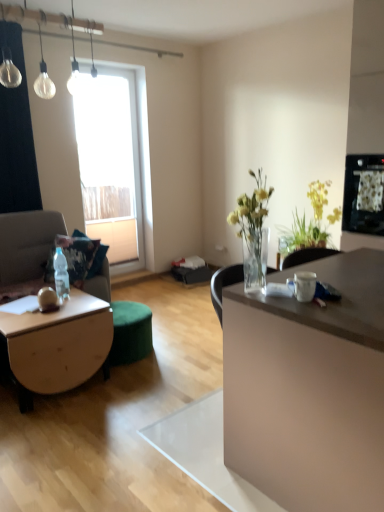
This screenshot has height=512, width=384. I want to click on free space above wooden coffee table at lower left (from a real-world perspective), so click(x=47, y=309).